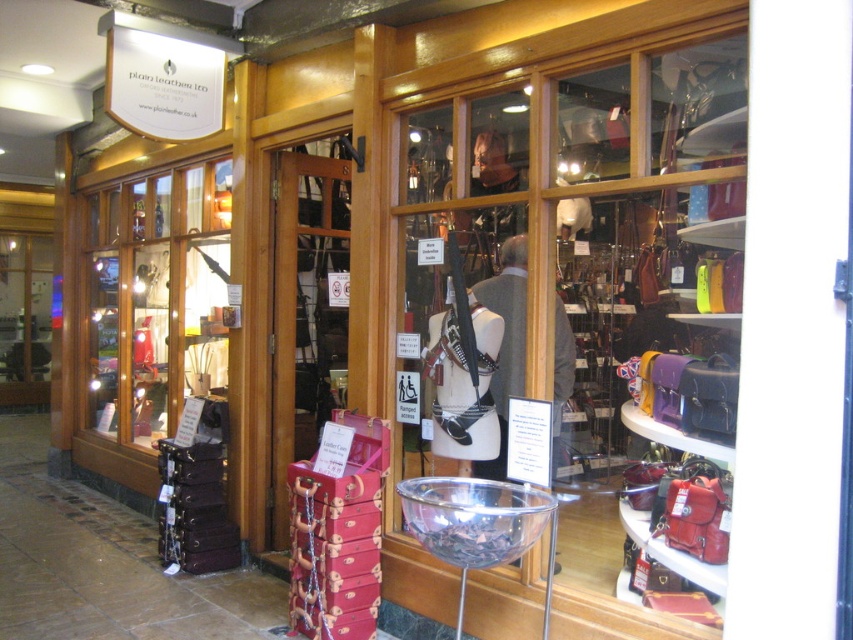
Question: Which object appears farthest from the camera in this image?

Choices:
 (A) shiny metallic bowl at center
 (B) matte black suitcase at left

Answer: (B)

Question: Can you confirm if shiny metallic bowl at center is smaller than matte black suitcase at left?

Choices:
 (A) no
 (B) yes

Answer: (B)

Question: Which of the following is the farthest from the observer?

Choices:
 (A) shiny metallic bowl at center
 (B) matte black suitcase at left

Answer: (B)

Question: Does shiny metallic bowl at center come in front of matte black suitcase at left?

Choices:
 (A) no
 (B) yes

Answer: (B)

Question: Can you confirm if shiny metallic bowl at center is bigger than matte black suitcase at left?

Choices:
 (A) no
 (B) yes

Answer: (A)